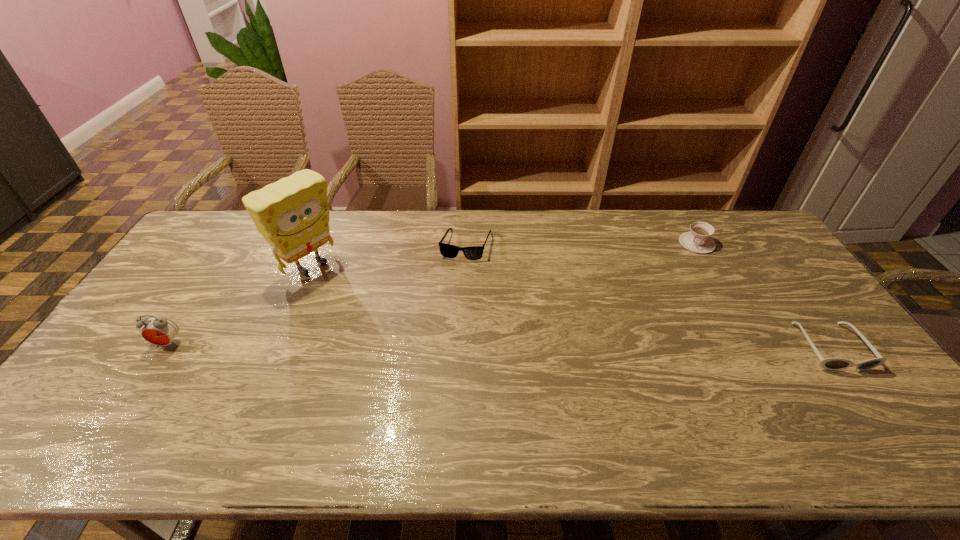
I want to click on alarm clock, so click(x=159, y=331).

Locate an element on the screen. The image size is (960, 540). the leftmost object is located at coordinates (159, 331).

I want to click on the nearer sunglasses, so click(x=829, y=363).

Where is `the rightmost object`? the rightmost object is located at coordinates (829, 363).

Identify the location of the left sunglasses. (449, 251).

The height and width of the screenshot is (540, 960). What are the coordinates of `the third object from left to right` in the screenshot? It's located at (449, 251).

Locate an element on the screen. This screenshot has width=960, height=540. sponge is located at coordinates (292, 214).

Find the location of `the second object from left to right`. the second object from left to right is located at coordinates pyautogui.click(x=292, y=214).

Where is `the fourth object from left to right`? This screenshot has width=960, height=540. the fourth object from left to right is located at coordinates (698, 240).

You are a GUI agent. You are given a task and a screenshot of the screen. Output one action in this format:
    pyautogui.click(x=<x>, y=<y>)
    Task: Click on the vacant space located 0.120m on the face of the alarm clock
    The height and width of the screenshot is (540, 960).
    Given the screenshot: What is the action you would take?
    pyautogui.click(x=139, y=388)